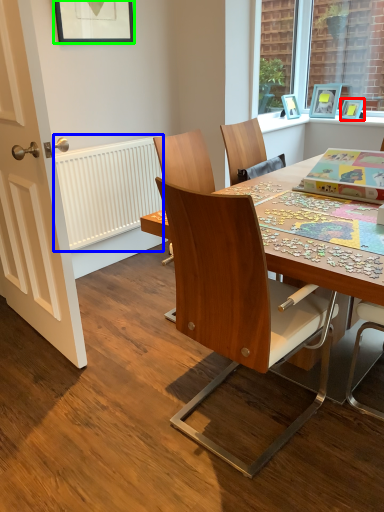
Question: Which is nearer to the picture frame (highlighted by a red box)? radiator (highlighted by a blue box) or picture frame (highlighted by a green box).

Choices:
 (A) radiator
 (B) picture frame

Answer: (A)